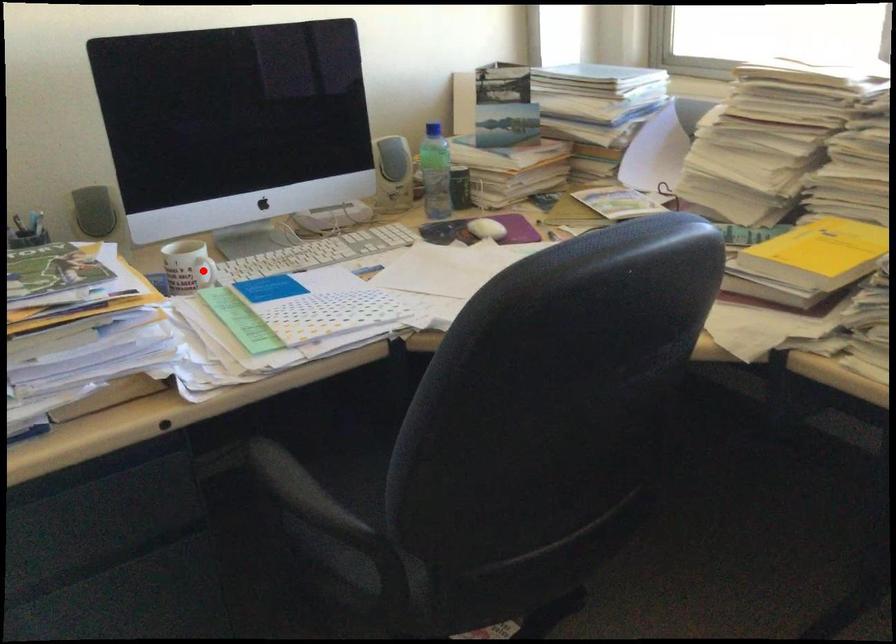
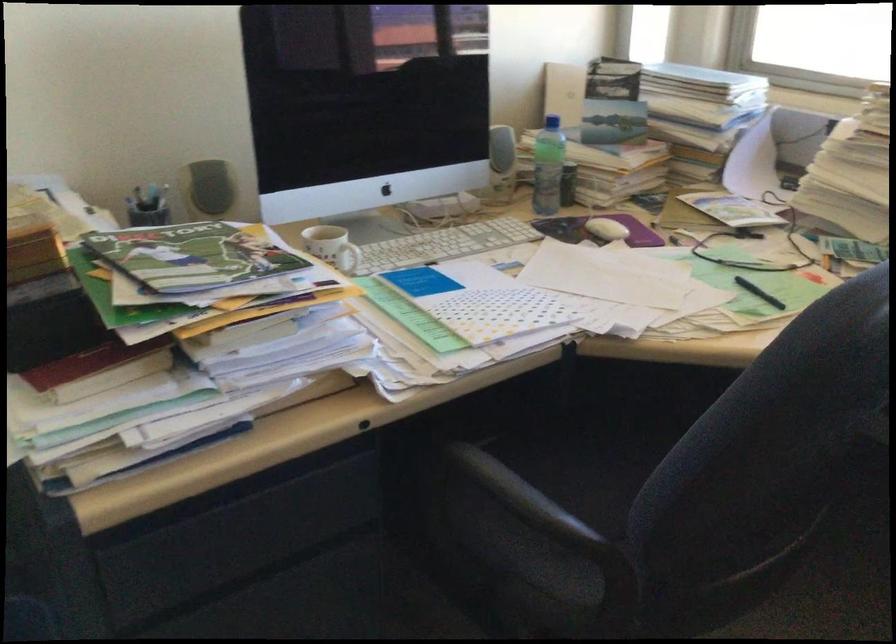
The point at the highlighted location is marked in the first image. Where is the corresponding point in the second image?

(348, 258)